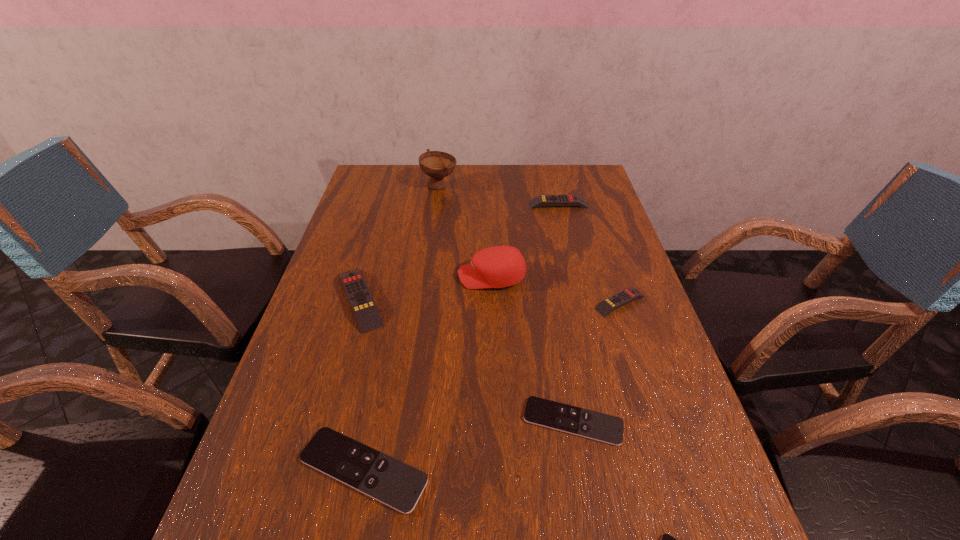
Identify the location of the farthest object. Image resolution: width=960 pixels, height=540 pixels. (436, 164).

The image size is (960, 540). Find the location of `the tallest object`. the tallest object is located at coordinates (436, 164).

I want to click on the second tallest object, so click(x=501, y=266).

Find the location of `red cap`. red cap is located at coordinates (501, 266).

Where is `the biggest yellow remote control`? This screenshot has height=540, width=960. the biggest yellow remote control is located at coordinates (360, 298).

Where is `the sixth shortest object`? the sixth shortest object is located at coordinates (360, 298).

Where is `the second farthest object`? The image size is (960, 540). the second farthest object is located at coordinates (x=542, y=200).

This screenshot has width=960, height=540. Identify the location of the farthest remote control. (542, 200).

The image size is (960, 540). Find the location of `the fifth tallest object`. the fifth tallest object is located at coordinates (622, 298).

This screenshot has height=540, width=960. Identify the location of the smallest yellow remote control. (622, 298).